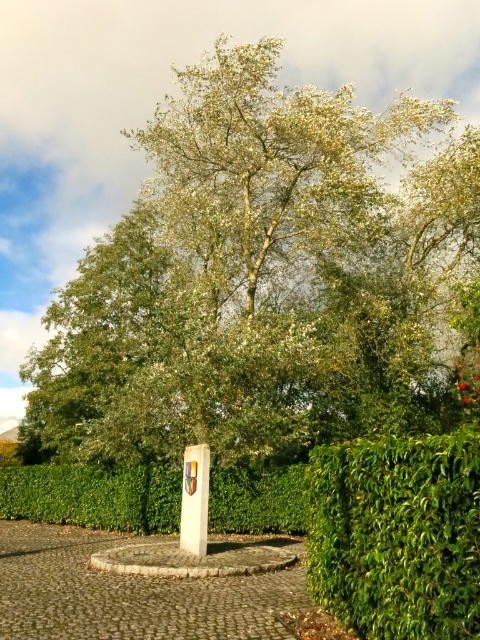
You are standing in the outdoor scene and want to walk from point A to point B. Point A is at coordinates point (37, 497) and point B is at coordinates point (192, 500). Considering the spatial arrangement, which direction should you move to get closer to point B?

To move from point A to point B, you should move away from the viewer since point A is closer to the viewer than point B.

You are a landscape architect designing a new garden. You need to place a new statue between the green leafy tree at center and the green leafy hedge at center. Which object should the statue be closer to if you want it to appear balanced in the composition?

The green leafy tree at center is larger in size than the green leafy hedge at center, so to achieve balance, the statue should be placed closer to the green leafy tree at center to compensate for its larger size.